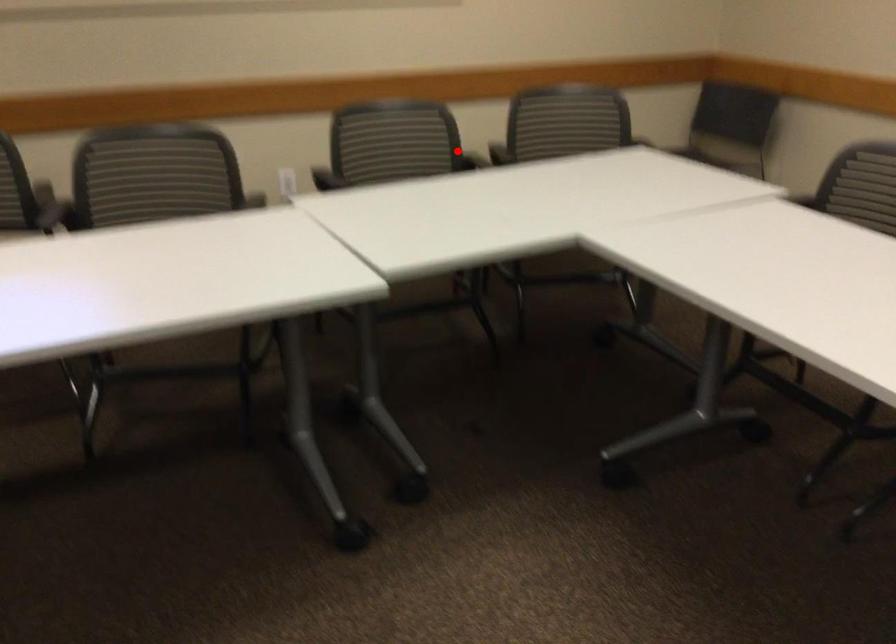
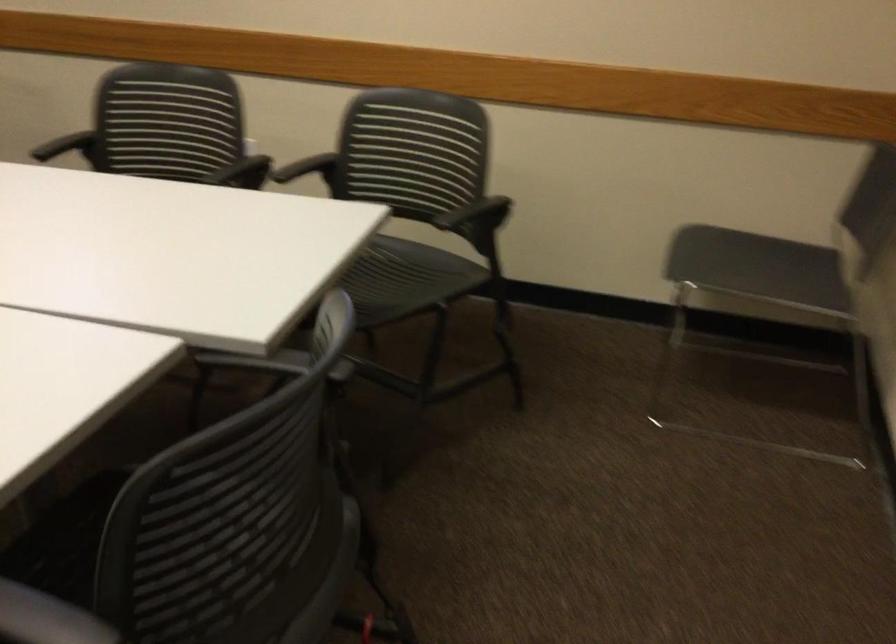
Question: I am providing you with two images of the same scene from different viewpoints. A red point is marked on the first image. Is the red point's position out of view in image 2?

Choices:
 (A) Yes
 (B) No

Answer: (A)